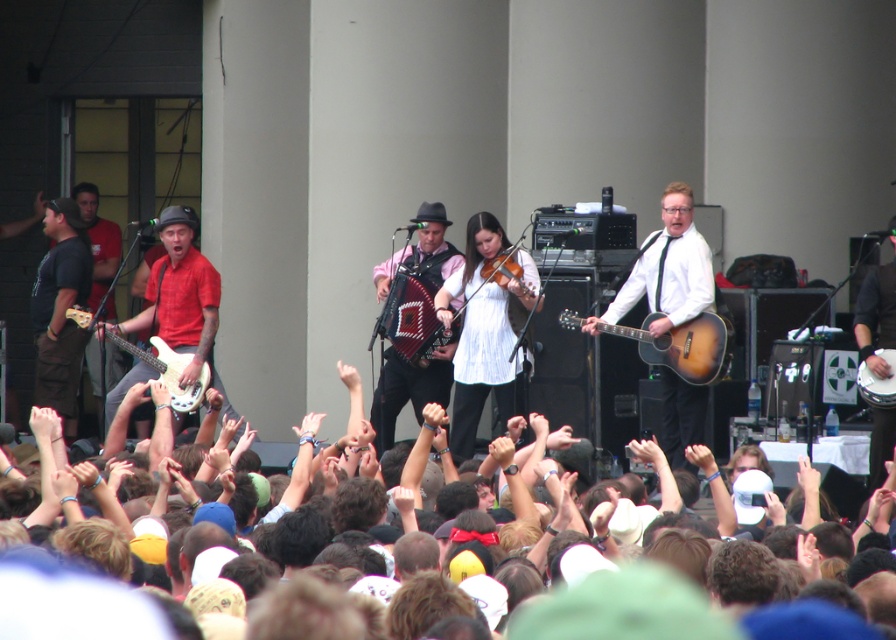
You are standing at the point labeled point (696, 371) and want to walk to the point labeled point (389, 291). Which direction should you move?

You should move backward because point (696, 371) is in front of point (389, 291).

Consider the image. You are a stagehand setting up microphones for the satin wood guitar at center and the white glossy electric guitar at left. Which guitar requires a larger microphone stand due to its size?

The satin wood guitar at center requires a larger microphone stand because it is bigger than the white glossy electric guitar at left.

You are a photographer at the concert and want to capture both the satin wood guitar at center and the white glossy electric guitar at left in a single shot. Which guitar should you focus on first if you want to ensure both are in frame without moving the camera?

The satin wood guitar at center has a lesser height compared to the white glossy electric guitar at left, so focusing on the taller white glossy electric guitar at left first would help ensure both guitars are within the frame since it occupies more vertical space.